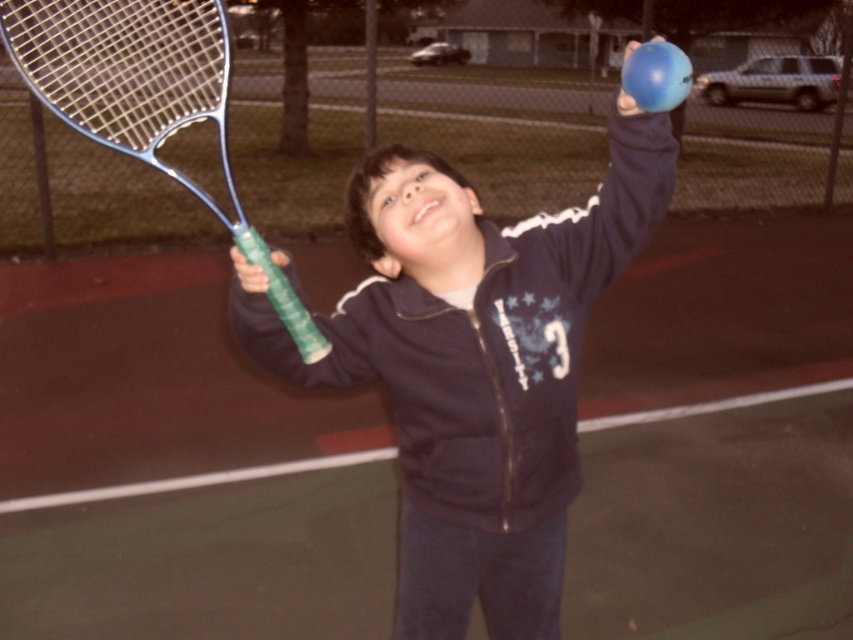
You are a tennis instructor observing a young boy on the court. You notice the green rubber tennis court at center and the blue metallic tennis racket at left. Which object has a smaller width?

The green rubber tennis court at center has a smaller width than the blue metallic tennis racket at left.

You are a photographer standing on the grassy area outside the tennis court. You want to take a photo of the blue metallic tennis racket at left and the green rubber tennis court at center so that both are clearly visible in the frame. Based on their positions, which object should you focus on first to ensure both are in focus?

The green rubber tennis court at center is positioned under the blue metallic tennis racket at left, so you should focus on the blue metallic tennis racket at left first to ensure both are in focus.